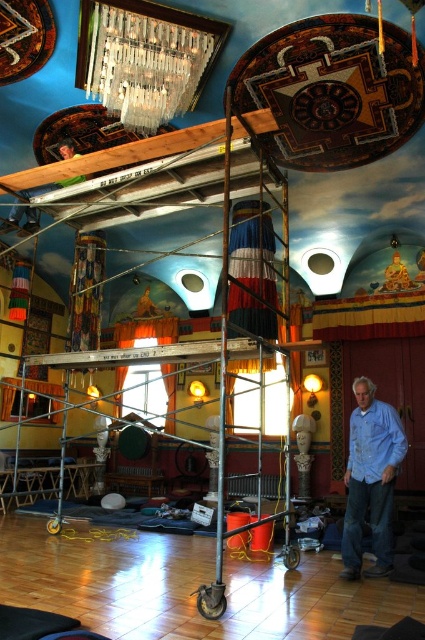
Can you confirm if metallic glass chandelier at upper center is taller than blue denim jeans at lower right?

No.

Is metallic glass chandelier at upper center below blue denim jeans at lower right?

No, metallic glass chandelier at upper center is not below blue denim jeans at lower right.

Measure the distance between point (116, 109) and camera.

A distance of 20.49 feet exists between point (116, 109) and camera.

This screenshot has width=425, height=640. Identify the location of metallic glass chandelier at upper center. (142, 58).